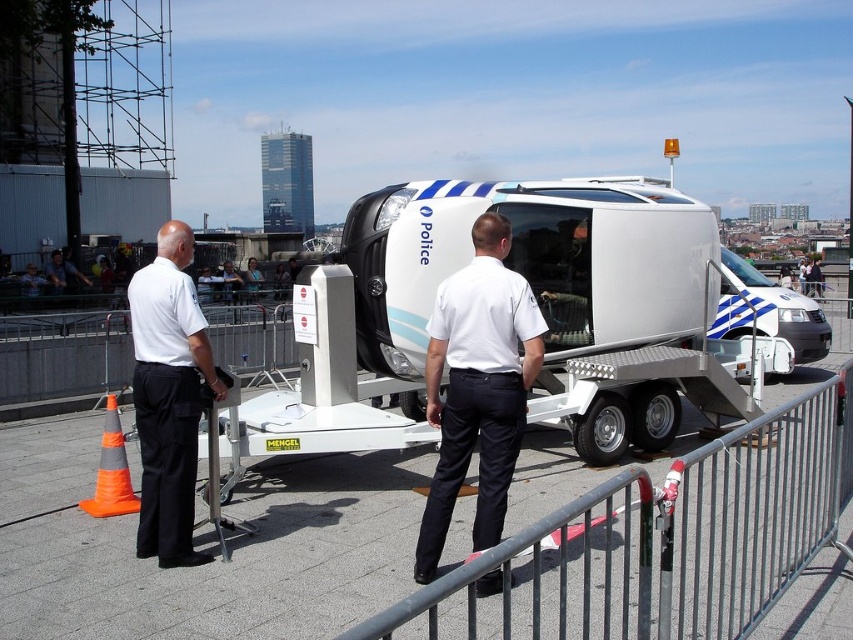
You are standing at the metal barricade and want to know which of the two points, point [506,340] or point [776,333], is closer to you. Can you determine this based on their positions?

Point [506,340] is closer to the viewer than point [776,333], so it is the closer point.

You are a delivery person who needs to park your van near the white glossy van at center. According to the coordinates provided, where should you position your van to ensure proper alignment?

The white glossy van at center is located at point (767, 310), so you should position your van near those coordinates for proper alignment.

You are a pedestrian trying to cross the street and see the metal at right and the white glossy van at center. Which object is closer to you?

The metal at right is closer to you because it is in front of the white glossy van at center.